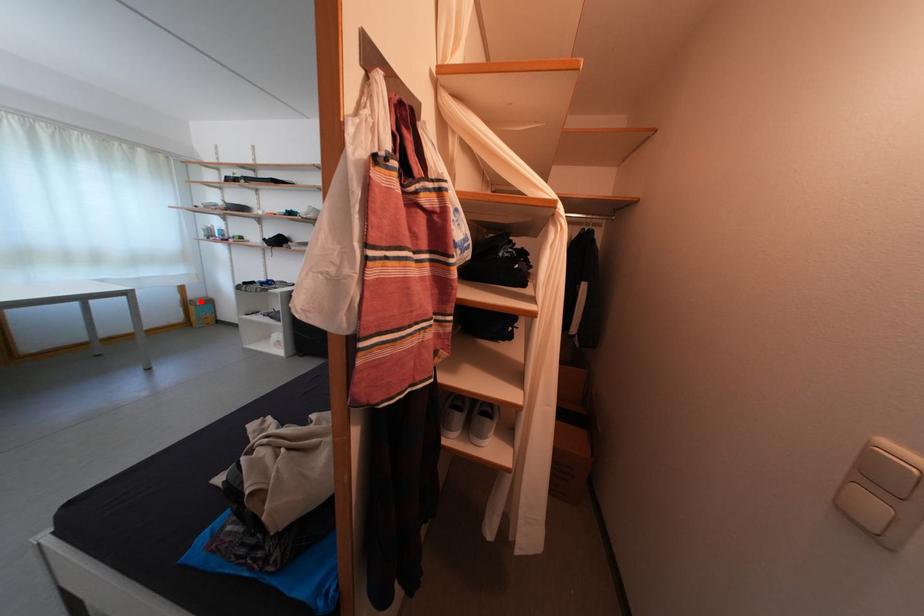
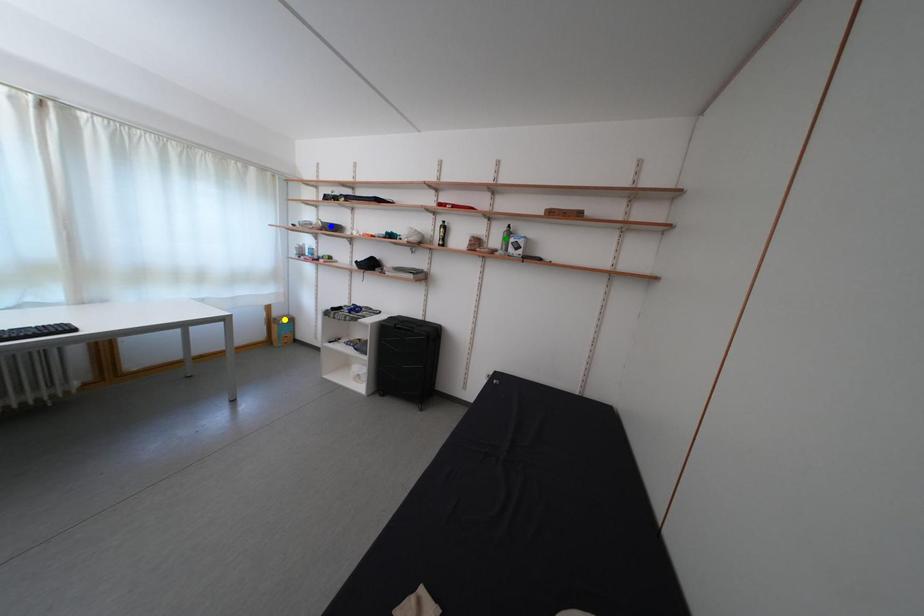
Question: I am providing you with two images of the same scene from different viewpoints. A red point is marked on the first image. You are given multiple points on the second image. Which spot in image 2 lines up with the point in image 1?

Choices:
 (A) green point
 (B) blue point
 (C) yellow point

Answer: (C)